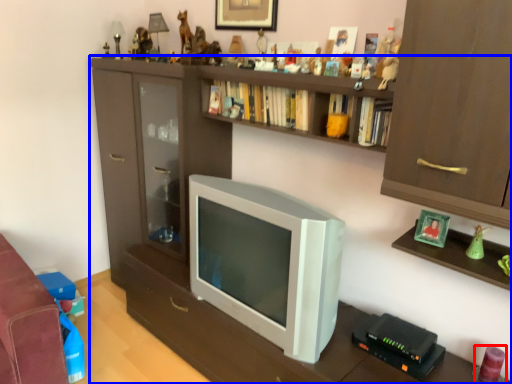
Question: Which object appears farthest to the camera in this image, toy (highlighted by a red box) or shelf (highlighted by a blue box)?

Choices:
 (A) toy
 (B) shelf

Answer: (A)